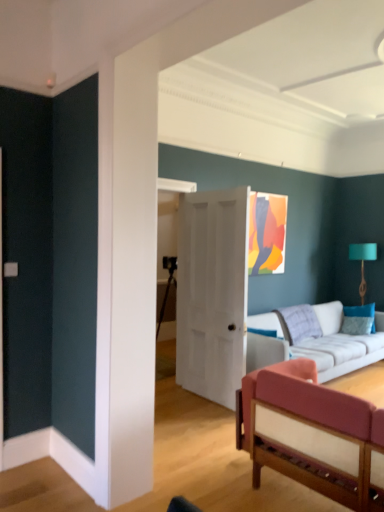
Question: Does teal fabric lampshade at right touch velvet pink couch at lower right, arranged as the 2th studio couch when viewed from the back?

Choices:
 (A) no
 (B) yes

Answer: (A)

Question: From a real-world perspective, is teal fabric lampshade at right located higher than velvet pink couch at lower right, arranged as the 2th studio couch when viewed from the back?

Choices:
 (A) yes
 (B) no

Answer: (A)

Question: Is velvet pink couch at lower right, arranged as the 2th studio couch when viewed from the back, a part of teal fabric lampshade at right?

Choices:
 (A) yes
 (B) no

Answer: (B)

Question: Can you confirm if teal fabric lampshade at right is bigger than velvet pink couch at lower right, which is the 1th studio couch in front-to-back order?

Choices:
 (A) no
 (B) yes

Answer: (A)

Question: From the image's perspective, is teal fabric lampshade at right located above velvet pink couch at lower right, arranged as the 2th studio couch when viewed from the back?

Choices:
 (A) yes
 (B) no

Answer: (A)

Question: Are teal fabric lampshade at right and velvet pink couch at lower right, arranged as the 2th studio couch when viewed from the back, located far from each other?

Choices:
 (A) yes
 (B) no

Answer: (A)

Question: Is white fabric couch at center, which ranks as the 2th studio couch in front-to-back order, to the right of white matte door at center from the viewer's perspective?

Choices:
 (A) yes
 (B) no

Answer: (A)

Question: Is white fabric couch at center, acting as the first studio couch starting from the back, smaller than white matte door at center?

Choices:
 (A) yes
 (B) no

Answer: (B)

Question: From the image's perspective, is white fabric couch at center, which ranks as the 2th studio couch in front-to-back order, located beneath white matte door at center?

Choices:
 (A) no
 (B) yes

Answer: (B)

Question: Does white fabric couch at center, which ranks as the 2th studio couch in front-to-back order, have a lesser height compared to white matte door at center?

Choices:
 (A) no
 (B) yes

Answer: (B)

Question: Does white fabric couch at center, acting as the first studio couch starting from the back, have a larger size compared to white matte door at center?

Choices:
 (A) yes
 (B) no

Answer: (A)

Question: Does white fabric couch at center, which ranks as the 2th studio couch in front-to-back order, lie behind white matte door at center?

Choices:
 (A) yes
 (B) no

Answer: (A)

Question: Is teal fabric lampshade at right to the right of white matte door at center from the viewer's perspective?

Choices:
 (A) no
 (B) yes

Answer: (B)